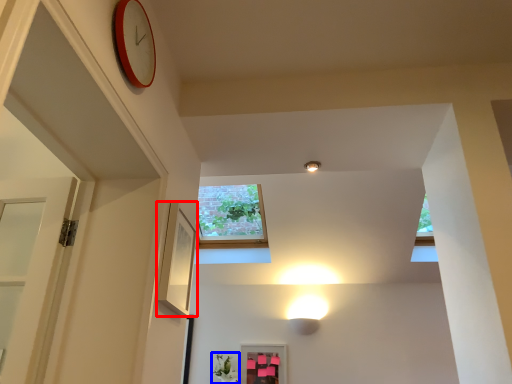
Question: Which of the following is the closest to the observer, picture frame (highlighted by a red box) or plant (highlighted by a blue box)?

Choices:
 (A) picture frame
 (B) plant

Answer: (A)